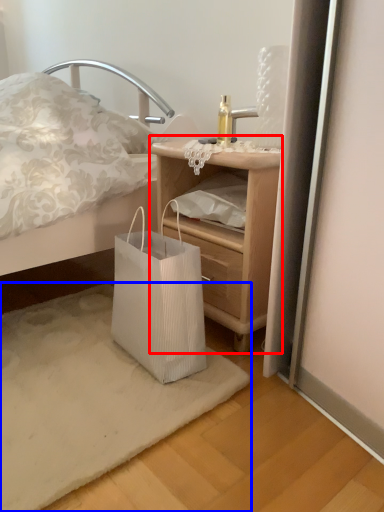
Question: Which object appears farthest to the camera in this image, nightstand (highlighted by a red box) or mat (highlighted by a blue box)?

Choices:
 (A) nightstand
 (B) mat

Answer: (A)